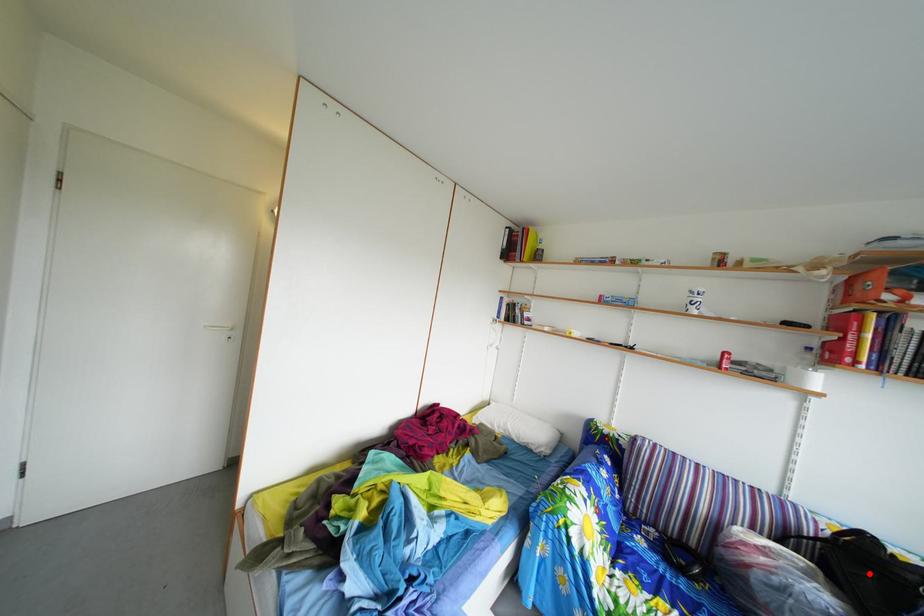
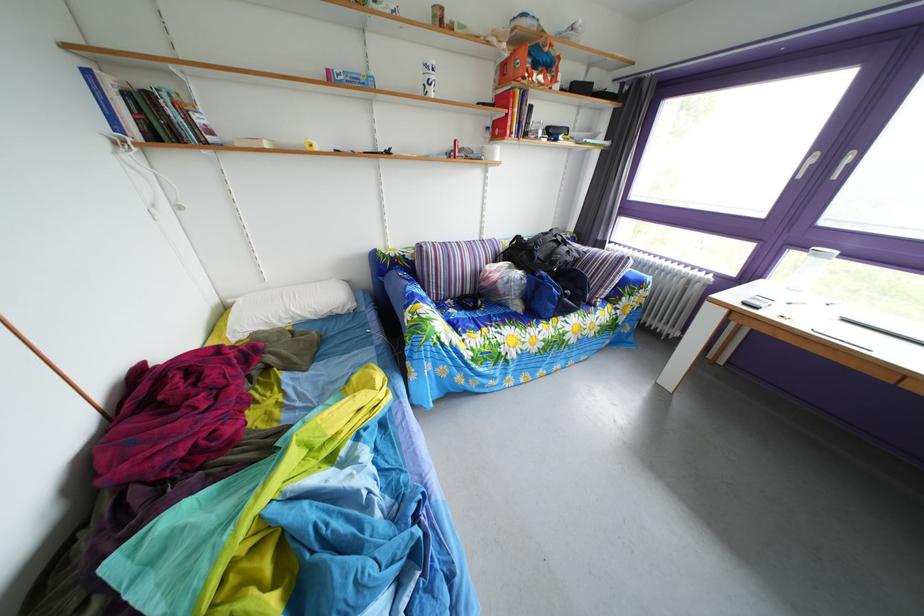
Find the pixel in the second image that matches the highlighted location in the first image.

(529, 261)